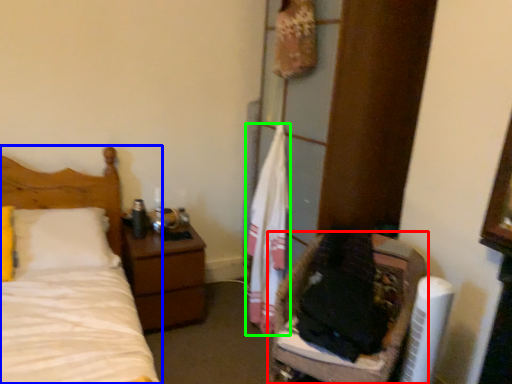
Question: Which object is positioned closest to furniture (highlighted by a red box)? Select from bed (highlighted by a blue box) and clothe (highlighted by a green box).

Choices:
 (A) bed
 (B) clothe

Answer: (B)